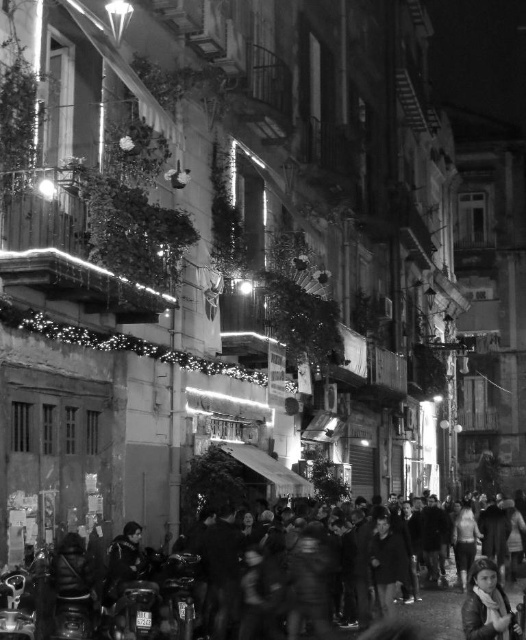
Question: Considering the relative positions of light brown hair at lower right and dark textured coat at lower left in the image provided, where is light brown hair at lower right located with respect to dark textured coat at lower left?

Choices:
 (A) below
 (B) above

Answer: (A)

Question: Which of the following is the closest to the observer?

Choices:
 (A) dark textured coat at lower left
 (B) light brown hair at lower right

Answer: (A)

Question: Does light brown hair at lower right appear on the right side of dark textured coat at lower left?

Choices:
 (A) no
 (B) yes

Answer: (B)

Question: Does light brown hair at lower right appear on the left side of dark textured coat at lower left?

Choices:
 (A) no
 (B) yes

Answer: (A)